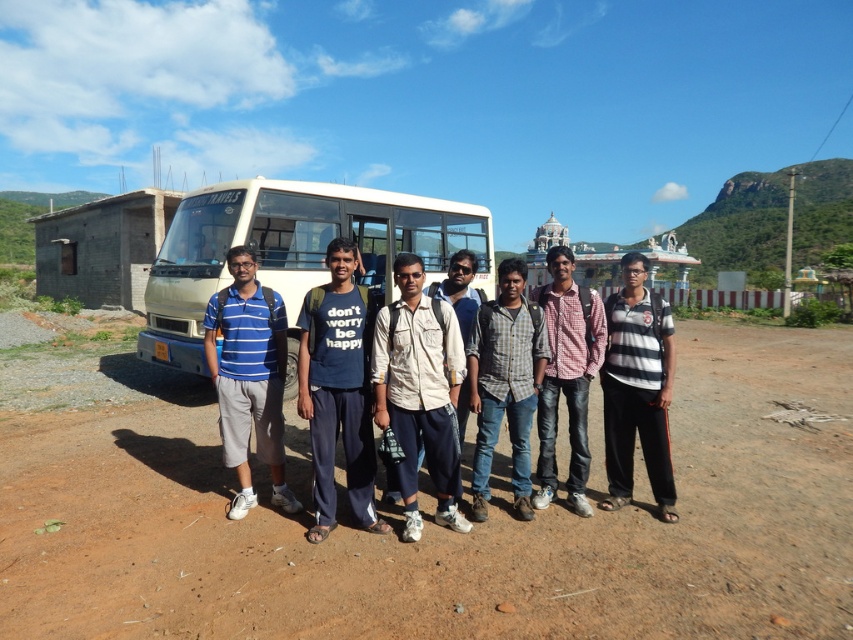
From the picture: Is checkered fabric shirt at center smaller than checkered shirt at center?

Indeed, checkered fabric shirt at center has a smaller size compared to checkered shirt at center.

Can you confirm if checkered fabric shirt at center is wider than checkered shirt at center?

Yes, checkered fabric shirt at center is wider than checkered shirt at center.

Does point (490, 324) come closer to viewer compared to point (550, 362)?

Yes.

Where is `checkered fabric shirt at center`? checkered fabric shirt at center is located at coordinates (505, 381).

Is brown sandy dirt at center smaller than checkered shirt at center?

No, brown sandy dirt at center is not smaller than checkered shirt at center.

Find the location of a particular element. This screenshot has width=853, height=640. brown sandy dirt at center is located at coordinates (447, 531).

Is checkered shirt at center below light brown cotton shirt at center?

Yes, checkered shirt at center is below light brown cotton shirt at center.

Does point (582, 442) lie in front of point (460, 300)?

Yes, it is.

Find the location of `checkered shirt at center`. checkered shirt at center is located at coordinates (566, 376).